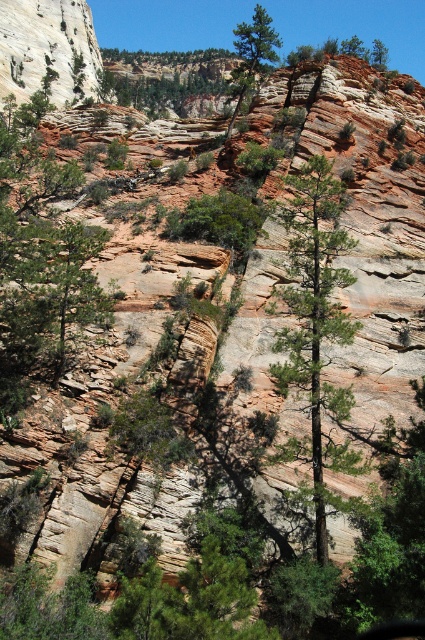
Does point (283, 337) lie in front of point (248, 35)?

Yes, point (283, 337) is closer to viewer.

Does green matte tree at center appear over green textured tree at center?

Incorrect, green matte tree at center is not positioned above green textured tree at center.

Does point (325, 285) lie in front of point (238, 28)?

Yes.

This screenshot has height=640, width=425. I want to click on green matte tree at center, so click(x=317, y=314).

Which is below, green matte tree at left or green leafy tree at upper center?

green matte tree at left is lower down.

The width and height of the screenshot is (425, 640). I want to click on green matte tree at left, so click(39, 260).

Is point (45, 358) closer to viewer compared to point (204, 60)?

Yes, it is.

Locate an element on the screen. green matte tree at left is located at coordinates (39, 260).

Between green matte tree at left and green matte tree at center, which one appears on the right side from the viewer's perspective?

green matte tree at center

Who is shorter, green matte tree at left or green matte tree at center?

green matte tree at center

I want to click on green matte tree at left, so click(x=39, y=260).

In order to click on green matte tree at left in this screenshot , I will do click(39, 260).